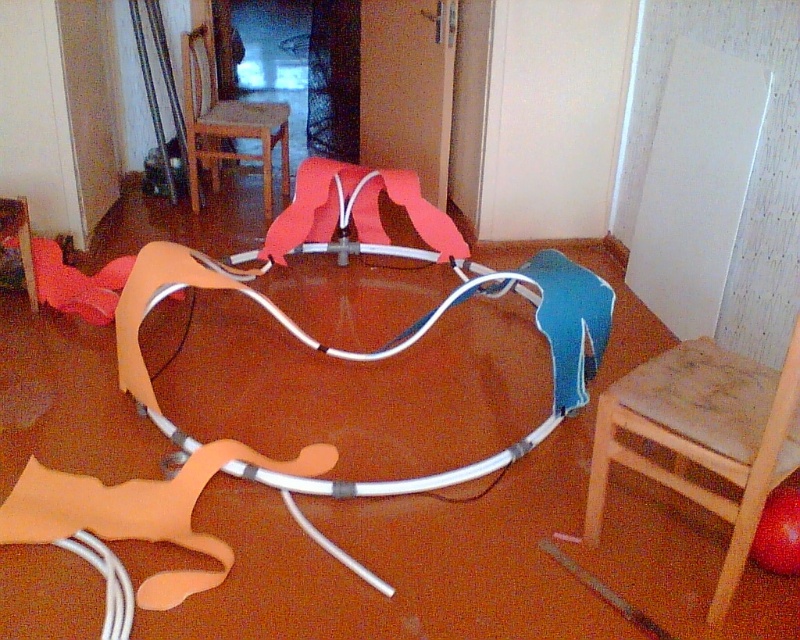
Question: Which object appears farthest from the camera in this image?

Choices:
 (A) metallic silver table at center
 (B) wooden chair at upper center
 (C) wooden stool at lower right

Answer: (B)

Question: Does wooden stool at lower right have a greater width compared to metallic silver hula hoop at center?

Choices:
 (A) no
 (B) yes

Answer: (A)

Question: Is metallic silver table at center smaller than metallic silver hula hoop at center?

Choices:
 (A) yes
 (B) no

Answer: (B)

Question: Observing the image, what is the correct spatial positioning of metallic silver table at center in reference to metallic silver hula hoop at center?

Choices:
 (A) left
 (B) right

Answer: (A)

Question: Which point is closer to the camera taking this photo?

Choices:
 (A) (612, 410)
 (B) (122, 340)
 (C) (194, 168)
 (D) (604, 294)

Answer: (A)

Question: Which point is closer to the camera taking this photo?

Choices:
 (A) (216, 152)
 (B) (596, 330)
 (C) (608, 461)
 (D) (550, 285)

Answer: (C)